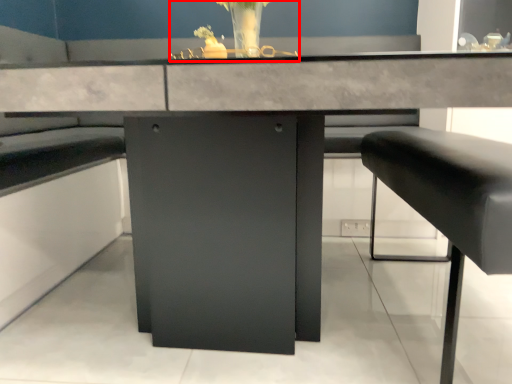
Question: From the image's perspective, where is floral arrangement (annotated by the red box) located relative to furniture?

Choices:
 (A) below
 (B) above

Answer: (B)